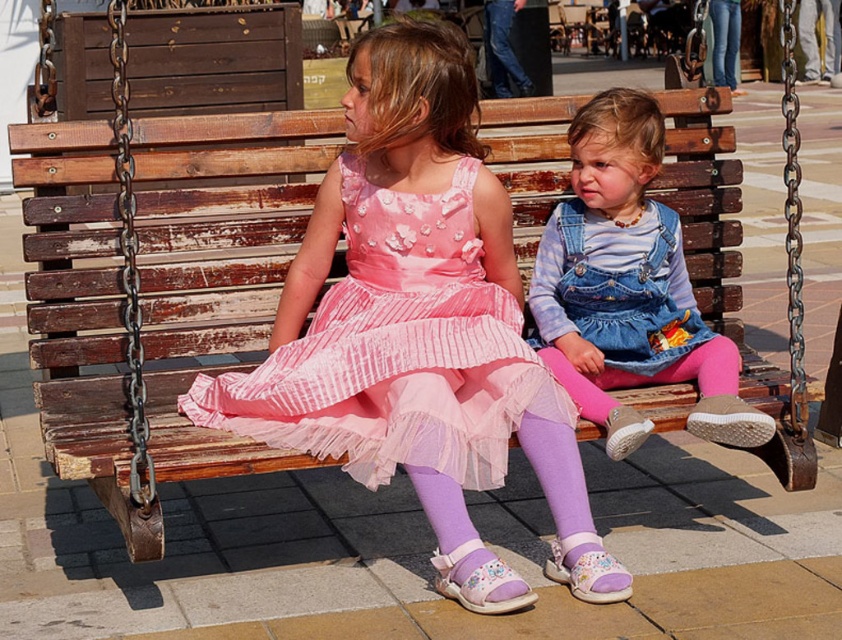
Question: Which of these objects is positioned closest to the wooden swing at center?

Choices:
 (A) denim overalls at center
 (B) pink tulle dress at center

Answer: (B)

Question: Is wooden swing at center smaller than denim overalls at center?

Choices:
 (A) yes
 (B) no

Answer: (B)

Question: Among these objects, which one is nearest to the camera?

Choices:
 (A) denim overalls at center
 (B) wooden swing at center

Answer: (B)

Question: Which of these objects is positioned closest to the wooden swing at center?

Choices:
 (A) denim overalls at center
 (B) pink tulle dress at center

Answer: (B)

Question: Does wooden swing at center have a larger size compared to pink tulle dress at center?

Choices:
 (A) yes
 (B) no

Answer: (A)

Question: Can you confirm if pink tulle dress at center is positioned above denim overalls at center?

Choices:
 (A) yes
 (B) no

Answer: (B)